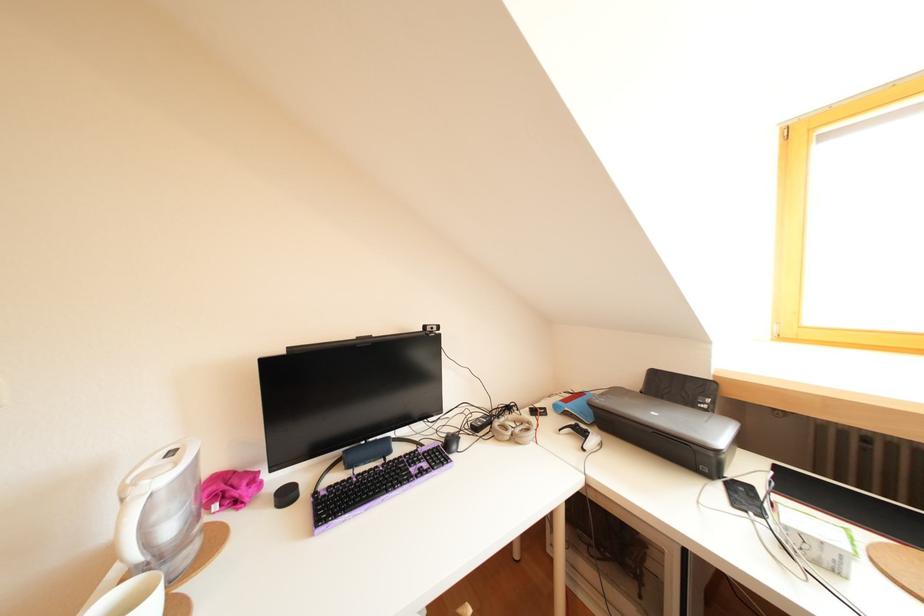
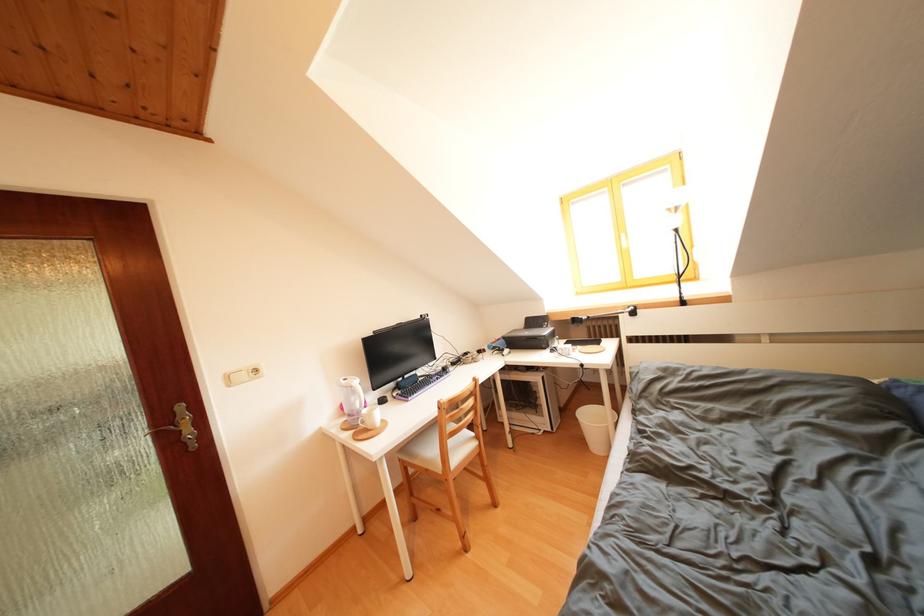
Which direction would the cameraman need to move to produce the second image?

The cameraman walked toward left, backward.